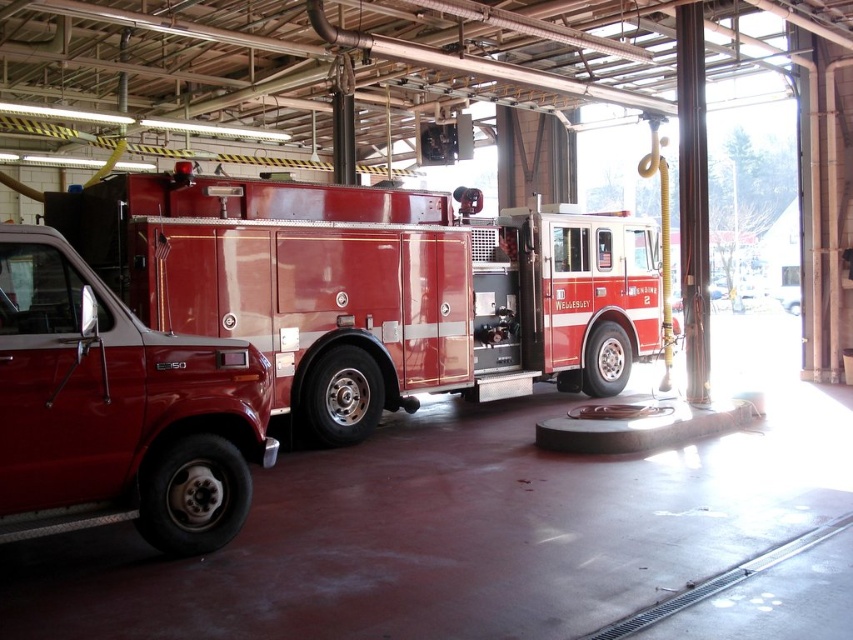
You are a firefighter who needs to quickly exit the fire station. You see the shiny red fire truck at center and the shiny silver tire at center. Which object is positioned to the right of the other?

The shiny red fire truck at center is to the right of the shiny silver tire at center.

You are a firefighter who needs to quickly access the shiny silver tire at center during an emergency. The shiny red fire truck at center is blocking the path. Can you move the fire truck to reach the tire? Explain your reasoning based on the distance between them.

The distance between the shiny red fire truck at center and the shiny silver tire at center is 4.23 feet. Since the tire is only 4.23 feet away from the truck, the firefighter can move the fire truck slightly to access the tire, as the short distance allows for maneuvering space.